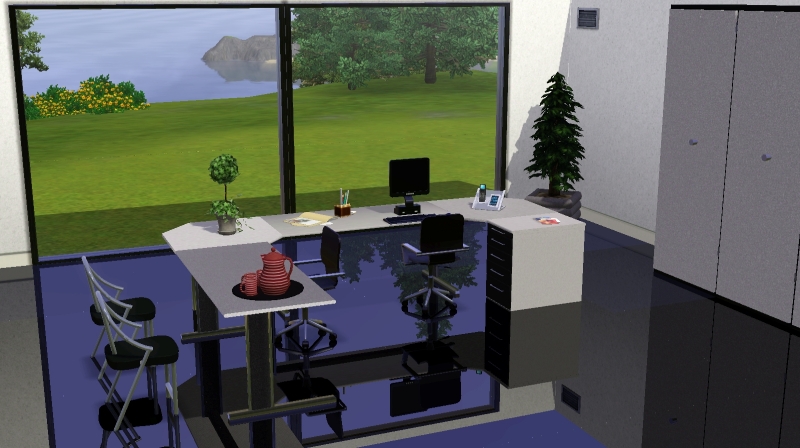
I want to click on phone, so pos(482,193).